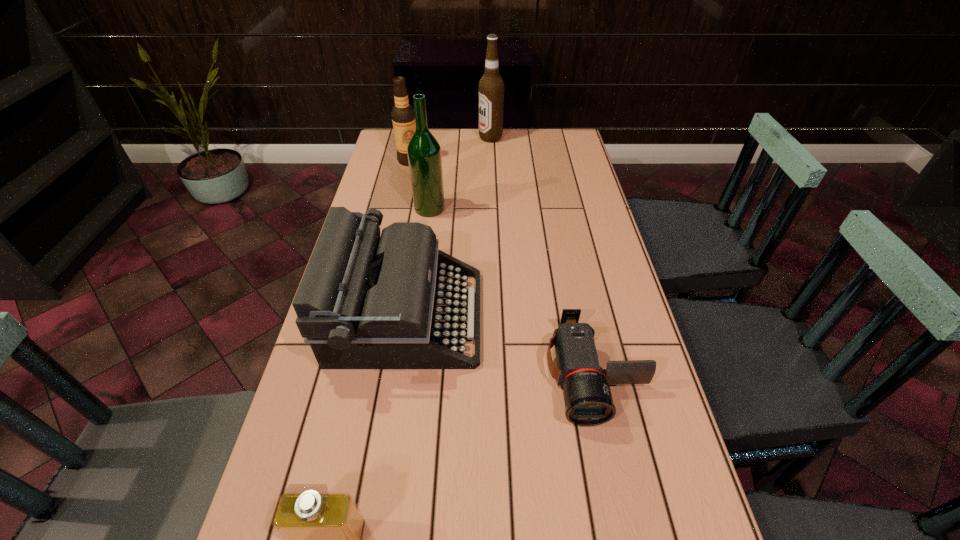
The height and width of the screenshot is (540, 960). I want to click on the farthest alcohol, so click(x=491, y=86).

You are a GUI agent. You are given a task and a screenshot of the screen. Output one action in this format:
    pyautogui.click(x=<x>, y=<y>)
    Task: Click on the farthest object
    
    Given the screenshot: What is the action you would take?
    pyautogui.click(x=491, y=86)

The width and height of the screenshot is (960, 540). I want to click on the second alcohol from right to left, so click(424, 152).

In order to click on the nearest alcohol in this screenshot , I will do `click(424, 152)`.

Where is `the second farthest alcohol`? the second farthest alcohol is located at coordinates (403, 116).

Identify the location of the shortest alcohol. Image resolution: width=960 pixels, height=540 pixels. (403, 116).

I want to click on the fourth tallest object, so click(395, 301).

At what (x,y) coordinates should I click in order to perform the action: click on camcorder. Please return your answer as a coordinate pair (x, y). The width and height of the screenshot is (960, 540). Looking at the image, I should click on (588, 401).

Where is `the shortest object`? Image resolution: width=960 pixels, height=540 pixels. the shortest object is located at coordinates (588, 401).

At what (x,y) coordinates should I click in order to perform the action: click on vacant point located 0.210m on the label of the farthest object. Please return your answer as a coordinate pair (x, y). Image resolution: width=960 pixels, height=540 pixels. Looking at the image, I should click on (426, 138).